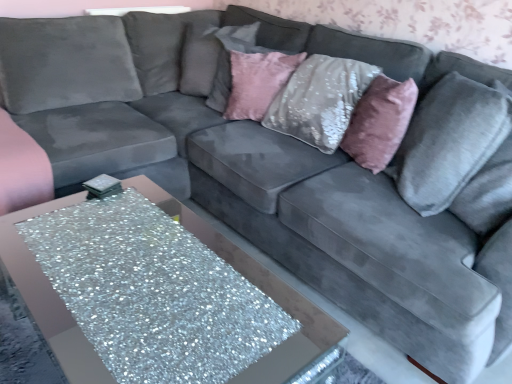
Describe the element at coordinates (230, 61) in the screenshot. I see `velvet gray pillow at upper center, placed as the 1th pillow when sorted from back to front` at that location.

Where is `velvet gray pillow at upper center, the 1th pillow viewed from the left`? The width and height of the screenshot is (512, 384). velvet gray pillow at upper center, the 1th pillow viewed from the left is located at coordinates (230, 61).

Where is `pink plush throw pillow at upper right`? The width and height of the screenshot is (512, 384). pink plush throw pillow at upper right is located at coordinates (380, 122).

Identify the location of pink velvet pillow at upper center, which is counted as the 2th pillow, starting from the back. The image size is (512, 384). (257, 82).

Which of these two, velvet gray pillow at right, marked as the third pillow in a left-to-right arrangement, or velvet gray pillow at upper center, placed as the 1th pillow when sorted from back to front, is wider?

With larger width is velvet gray pillow at right, marked as the third pillow in a left-to-right arrangement.

Is velvet gray pillow at right, which is counted as the 3th pillow, starting from the back, behind velvet gray pillow at upper center, placed as the 1th pillow when sorted from back to front?

That is False.

From the image's perspective, starting from the velvet gray pillow at right, which is counted as the 3th pillow, starting from the back, which pillow is the 2nd one above? Please provide its 2D coordinates.

[(230, 61)]

Considering the positions of points (450, 72) and (227, 84), is point (450, 72) farther from camera compared to point (227, 84)?

No, it is in front of (227, 84).

From a real-world perspective, relative to velvet gray pillow at right, which is counted as the 3th pillow, starting from the back, is pink velvet pillow at upper center, which is the second pillow from right to left, vertically above or below?

In terms of real-world spatial position, pink velvet pillow at upper center, which is the second pillow from right to left, is below velvet gray pillow at right, which is counted as the 3th pillow, starting from the back.

Can you confirm if pink velvet pillow at upper center, which is counted as the 2th pillow, starting from the back, is wider than velvet gray pillow at right, marked as the third pillow in a left-to-right arrangement?

In fact, pink velvet pillow at upper center, which is counted as the 2th pillow, starting from the back, might be narrower than velvet gray pillow at right, marked as the third pillow in a left-to-right arrangement.

Is pink velvet pillow at upper center, which ranks as the second pillow in front-to-back order, shorter than velvet gray pillow at right, which is the first pillow from front to back?

Yes.

Is pink velvet pillow at upper center, which is the second pillow from right to left, smaller than velvet gray pillow at right, which is counted as the 3th pillow, starting from the back?

Correct, pink velvet pillow at upper center, which is the second pillow from right to left, occupies less space than velvet gray pillow at right, which is counted as the 3th pillow, starting from the back.

Between velvet gray pillow at right, marked as the third pillow in a left-to-right arrangement, and pink plush throw pillow at upper right, which one has larger width?

velvet gray pillow at right, marked as the third pillow in a left-to-right arrangement, is wider.

Between velvet gray pillow at right, which is the first pillow from front to back, and pink plush throw pillow at upper right, which one has smaller size?

pink plush throw pillow at upper right is smaller.

Is pink plush throw pillow at upper right a part of velvet gray pillow at right, the first pillow positioned from the right?

No, pink plush throw pillow at upper right is not inside velvet gray pillow at right, the first pillow positioned from the right.

Who is smaller, pink velvet pillow at upper center, which is counted as the 2th pillow, starting from the back, or pink plush throw pillow at upper right?

With smaller size is pink velvet pillow at upper center, which is counted as the 2th pillow, starting from the back.

Is pink velvet pillow at upper center, which is the second pillow from right to left, next to pink plush throw pillow at upper right and touching it?

No, pink velvet pillow at upper center, which is the second pillow from right to left, is not in contact with pink plush throw pillow at upper right.

Is point (247, 77) positioned before point (416, 101)?

No, (247, 77) is further to viewer.

Would you consider velvet gray pillow at upper center, placed as the 1th pillow when sorted from back to front, to be distant from pink plush throw pillow at upper right?

No, velvet gray pillow at upper center, placed as the 1th pillow when sorted from back to front, is not far away from pink plush throw pillow at upper right.

Which is more distant, (224, 75) or (360, 134)?

The point (224, 75) is farther from the camera.

Is velvet gray pillow at upper center, the 1th pillow viewed from the left, located outside pink plush throw pillow at upper right?

That's correct, velvet gray pillow at upper center, the 1th pillow viewed from the left, is outside of pink plush throw pillow at upper right.

From the picture: Could you tell me if velvet gray pillow at upper center, marked as the 3th pillow in a right-to-left arrangement, is facing pink plush throw pillow at upper right?

No, velvet gray pillow at upper center, marked as the 3th pillow in a right-to-left arrangement, is not facing towards pink plush throw pillow at upper right.

Considering the sizes of objects glittery silver table at lower left and velvet gray pillow at right, which is counted as the 3th pillow, starting from the back, in the image provided, who is shorter, glittery silver table at lower left or velvet gray pillow at right, which is counted as the 3th pillow, starting from the back,?

With less height is glittery silver table at lower left.

Are glittery silver table at lower left and velvet gray pillow at right, marked as the third pillow in a left-to-right arrangement, far apart?

That's right, there is a large distance between glittery silver table at lower left and velvet gray pillow at right, marked as the third pillow in a left-to-right arrangement.

From a real-world perspective, relative to velvet gray pillow at right, which is counted as the 3th pillow, starting from the back, is glittery silver table at lower left vertically above or below?

glittery silver table at lower left is situated lower than velvet gray pillow at right, which is counted as the 3th pillow, starting from the back, in the real world.

Does point (234, 256) lie behind point (418, 154)?

Yes, it is.

From the image's perspective, is pink velvet pillow at upper center, which ranks as the second pillow in front-to-back order, positioned above or below glittery silver table at lower left?

Based on their image positions, pink velvet pillow at upper center, which ranks as the second pillow in front-to-back order, is located above glittery silver table at lower left.

Can you confirm if pink velvet pillow at upper center, the 2th pillow positioned from the left, is shorter than glittery silver table at lower left?

Correct, pink velvet pillow at upper center, the 2th pillow positioned from the left, is not as tall as glittery silver table at lower left.

Can glittery silver table at lower left be found inside pink velvet pillow at upper center, which is the second pillow from right to left?

No, glittery silver table at lower left is located outside of pink velvet pillow at upper center, which is the second pillow from right to left.

In the image, is pink velvet pillow at upper center, the 2th pillow positioned from the left, on the left side or the right side of glittery silver table at lower left?

In the image, pink velvet pillow at upper center, the 2th pillow positioned from the left, appears on the right side of glittery silver table at lower left.

From a real-world perspective, count 1st pillows downward from the velvet gray pillow at upper center, marked as the 3th pillow in a right-to-left arrangement, and point to it. Please provide its 2D coordinates.

[(449, 141)]

From a real-world perspective, which pillow is the 1st one above the pink velvet pillow at upper center, which ranks as the second pillow in front-to-back order? Please provide its 2D coordinates.

[(449, 141)]

From the image, which object appears to be nearer to pink plush throw pillow at upper right, velvet gray pillow at upper center, the 3th pillow when ordered from front to back, or glittery silver table at lower left?

The object closer to pink plush throw pillow at upper right is velvet gray pillow at upper center, the 3th pillow when ordered from front to back.

Which object lies further to the anchor point velvet gray pillow at right, which is counted as the 3th pillow, starting from the back, velvet gray pillow at upper center, marked as the 3th pillow in a right-to-left arrangement, or glittery silver table at lower left?

glittery silver table at lower left is positioned further to the anchor velvet gray pillow at right, which is counted as the 3th pillow, starting from the back.

When comparing their distances from velvet gray pillow at upper center, marked as the 3th pillow in a right-to-left arrangement, does glittery silver table at lower left or velvet gray pillow at right, the first pillow positioned from the right, seem further?

The object further to velvet gray pillow at upper center, marked as the 3th pillow in a right-to-left arrangement, is glittery silver table at lower left.

Looking at the image, which one is located closer to velvet gray pillow at right, marked as the third pillow in a left-to-right arrangement, glittery silver table at lower left or pink plush throw pillow at upper right?

pink plush throw pillow at upper right is positioned closer to the anchor velvet gray pillow at right, marked as the third pillow in a left-to-right arrangement.

Based on their spatial positions, is pink plush throw pillow at upper right or velvet gray pillow at right, which is the first pillow from front to back, closer to velvet gray pillow at upper center, the 3th pillow when ordered from front to back?

Among the two, pink plush throw pillow at upper right is located nearer to velvet gray pillow at upper center, the 3th pillow when ordered from front to back.

Based on their spatial positions, is pink plush throw pillow at upper right or glittery silver table at lower left further from pink velvet pillow at upper center, which is the second pillow from right to left?

glittery silver table at lower left is positioned further to the anchor pink velvet pillow at upper center, which is the second pillow from right to left.

Which object lies nearer to the anchor point glittery silver table at lower left, pink plush throw pillow at upper right or pink velvet pillow at upper center, which ranks as the second pillow in front-to-back order?

pink velvet pillow at upper center, which ranks as the second pillow in front-to-back order.

Looking at the image, which one is located further to pink plush throw pillow at upper right, glittery silver table at lower left or pink velvet pillow at upper center, which is the second pillow from right to left?

glittery silver table at lower left is positioned further to the anchor pink plush throw pillow at upper right.

At what (x,y) coordinates should I click in order to perform the action: click on throw pillow located between glittery silver table at lower left and velvet gray pillow at right, which is the first pillow from front to back, in the left-right direction. Please return your answer as a coordinate pair (x, y). This screenshot has height=384, width=512. Looking at the image, I should click on (380, 122).

The height and width of the screenshot is (384, 512). Identify the location of pillow positioned between glittery silver table at lower left and pink velvet pillow at upper center, which is counted as the 2th pillow, starting from the back, from near to far. (449, 141).

I want to click on pillow between pink plush throw pillow at upper right and velvet gray pillow at upper center, marked as the 3th pillow in a right-to-left arrangement, in the front-back direction, so click(x=257, y=82).

Locate an element on the screen. The image size is (512, 384). throw pillow between glittery silver table at lower left and pink velvet pillow at upper center, the 2th pillow positioned from the left, along the z-axis is located at coordinates (380, 122).